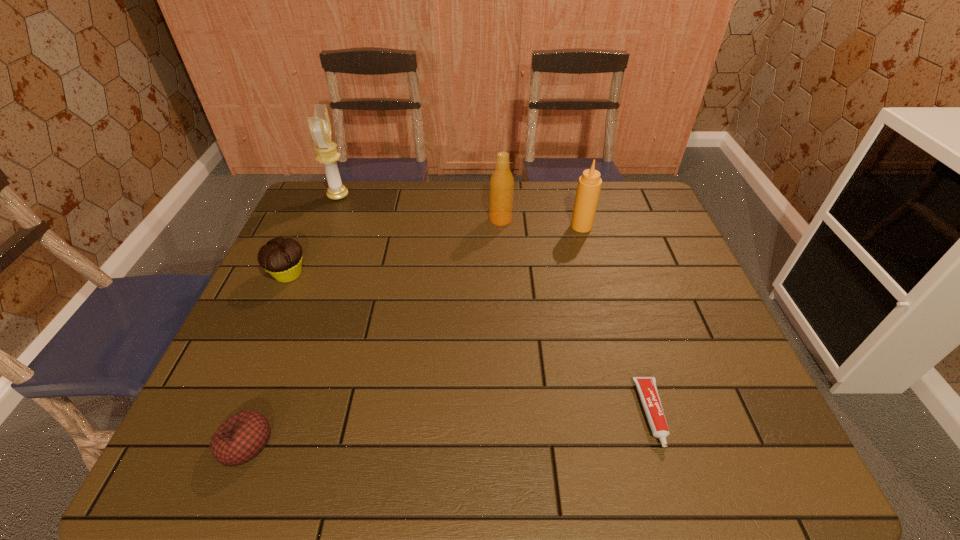
Where is `free space that satisfies the following two spatial constraints: 1. on the back side of the condiment; 2. on the left side of the fifth tallest object`? The width and height of the screenshot is (960, 540). free space that satisfies the following two spatial constraints: 1. on the back side of the condiment; 2. on the left side of the fifth tallest object is located at coordinates (331, 226).

I want to click on free space that satisfies the following two spatial constraints: 1. on the front-facing side of the third object from right to left; 2. on the right side of the tallest object, so click(328, 220).

I want to click on vacant space that satisfies the following two spatial constraints: 1. on the front-facing side of the condiment; 2. on the right side of the award, so click(325, 226).

Locate an element on the screen. The image size is (960, 540). blank area in the image that satisfies the following two spatial constraints: 1. on the back side of the fourth farthest object; 2. on the left side of the condiment is located at coordinates (310, 226).

Where is `free space that satisfies the following two spatial constraints: 1. on the front-facing side of the beanbag; 2. on the right side of the farthest object`? free space that satisfies the following two spatial constraints: 1. on the front-facing side of the beanbag; 2. on the right side of the farthest object is located at coordinates (237, 443).

Locate an element on the screen. vacant space that satisfies the following two spatial constraints: 1. on the front-facing side of the fourth object from left to right; 2. on the right side of the tallest object is located at coordinates (328, 220).

In order to click on blank space that satisfies the following two spatial constraints: 1. on the back side of the fourth object from left to right; 2. on the front-facing side of the tallest object in this screenshot , I will do [499, 196].